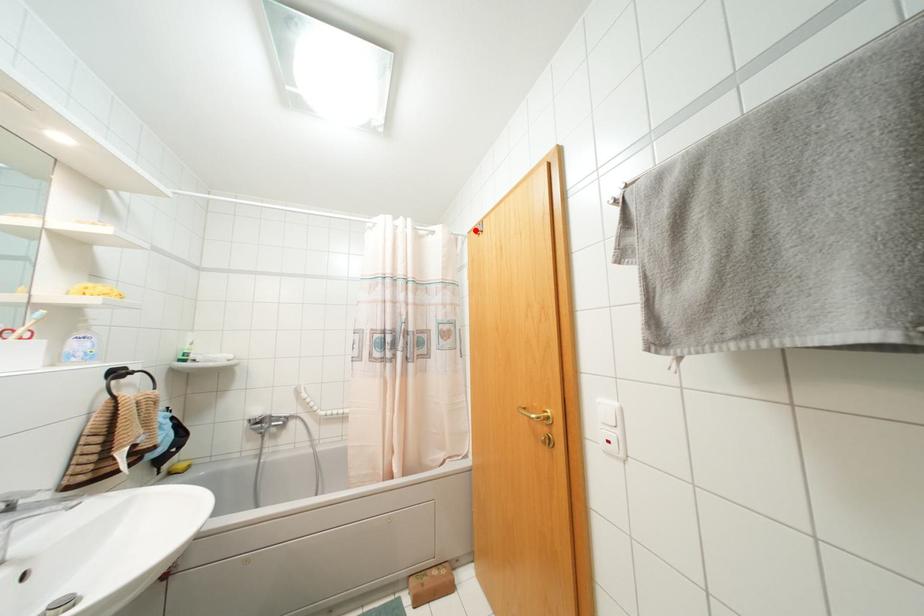
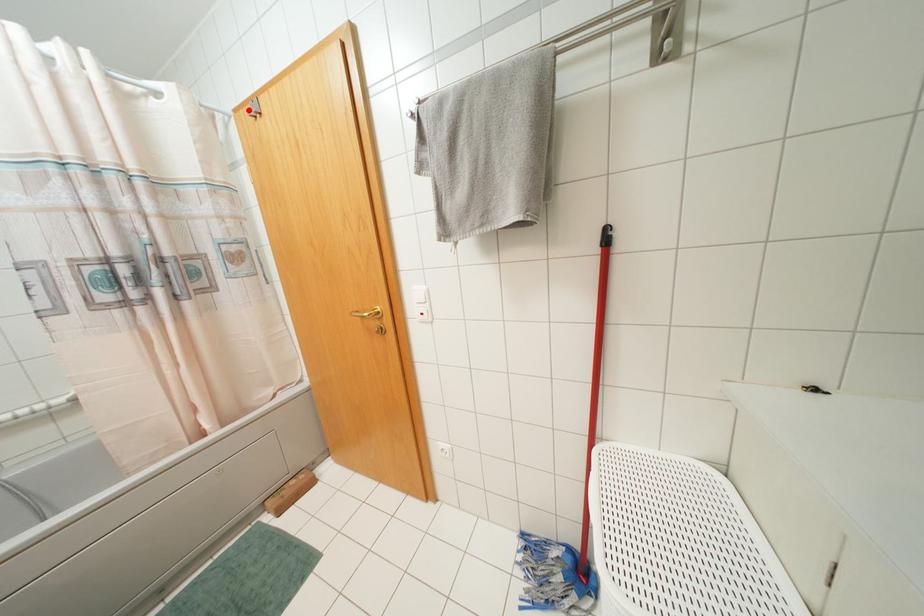
I am providing you with two images of the same scene from different viewpoints. A red point is marked on the first image and another point is marked on the second image. Is the marked point in image1 the same physical position as the marked point in image2?

Yes